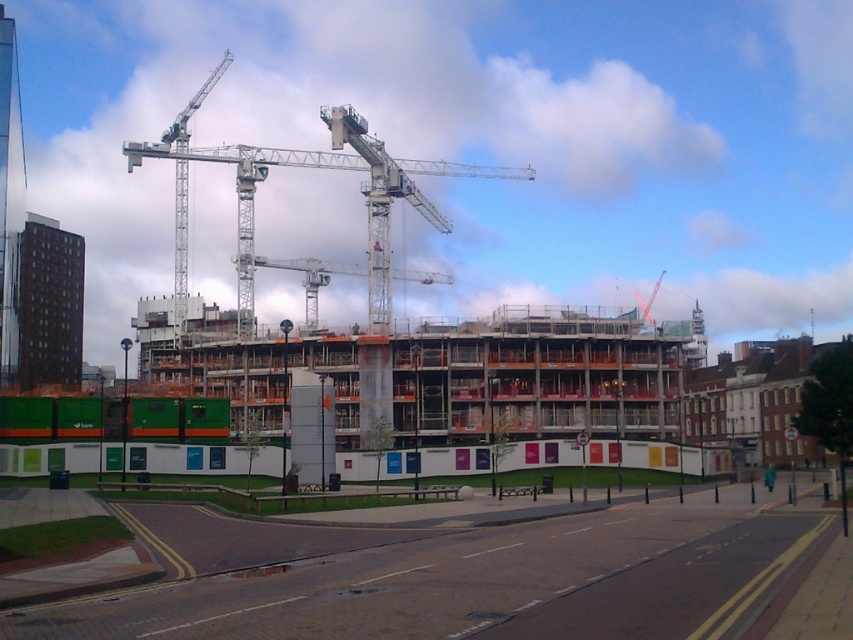
Question: Is concrete wall at center wider than white metallic crane at upper center?

Choices:
 (A) no
 (B) yes

Answer: (A)

Question: Which object is farther from the camera taking this photo?

Choices:
 (A) concrete wall at center
 (B) white metallic crane at upper center

Answer: (B)

Question: Can you confirm if concrete wall at center is bigger than white metallic crane at upper center?

Choices:
 (A) yes
 (B) no

Answer: (B)

Question: Which point is closer to the camera taking this photo?

Choices:
 (A) (343, 108)
 (B) (737, 518)

Answer: (B)

Question: Is concrete wall at center to the right of white metallic crane at upper center from the viewer's perspective?

Choices:
 (A) yes
 (B) no

Answer: (A)